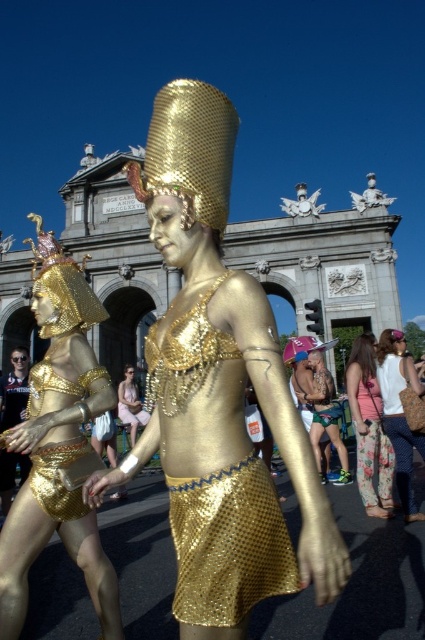
Question: Does floral fabric pants at lower right come behind green fabric shorts at center?

Choices:
 (A) no
 (B) yes

Answer: (A)

Question: Can you confirm if floral fabric pants at lower right is wider than green fabric shorts at center?

Choices:
 (A) no
 (B) yes

Answer: (A)

Question: In this image, where is gold sequined skirt at lower center located relative to metallic gold bikini at center?

Choices:
 (A) right
 (B) left

Answer: (B)

Question: Which point is farther to the camera?

Choices:
 (A) matte gold fabric dress at center
 (B) gold sequined skirt at center
 (C) floral fabric dress at lower right

Answer: (A)

Question: Among these objects, which one is nearest to the camera?

Choices:
 (A) matte gold fabric dress at center
 (B) gold sequined skirt at center
 (C) green fabric shorts at center

Answer: (B)

Question: Which of the following is the closest to the observer?

Choices:
 (A) (323, 385)
 (B) (209, 369)
 (C) (368, 176)
 (D) (102, 371)

Answer: (B)